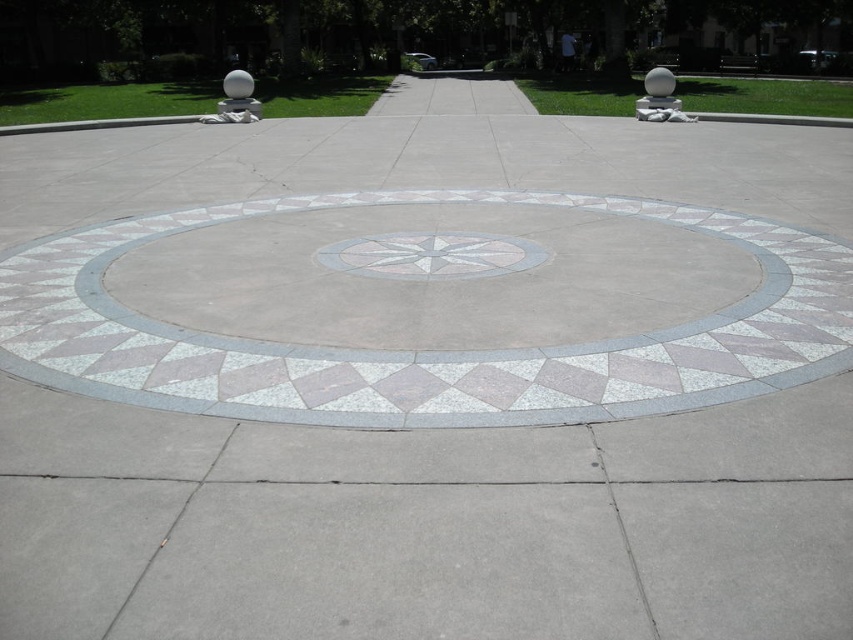
You are standing in the plaza and want to find the central compass rose. According to the image, where exactly is the white mosaic circle at center positioned?

The white mosaic circle at center is located at point coordinates of (384, 49).

You are standing in the plaza and notice two central features. The white mosaic circle at center and the white marble compass at center. Which one has a larger diameter?

The white mosaic circle at center has a larger diameter than the white marble compass at center according to the description provided.